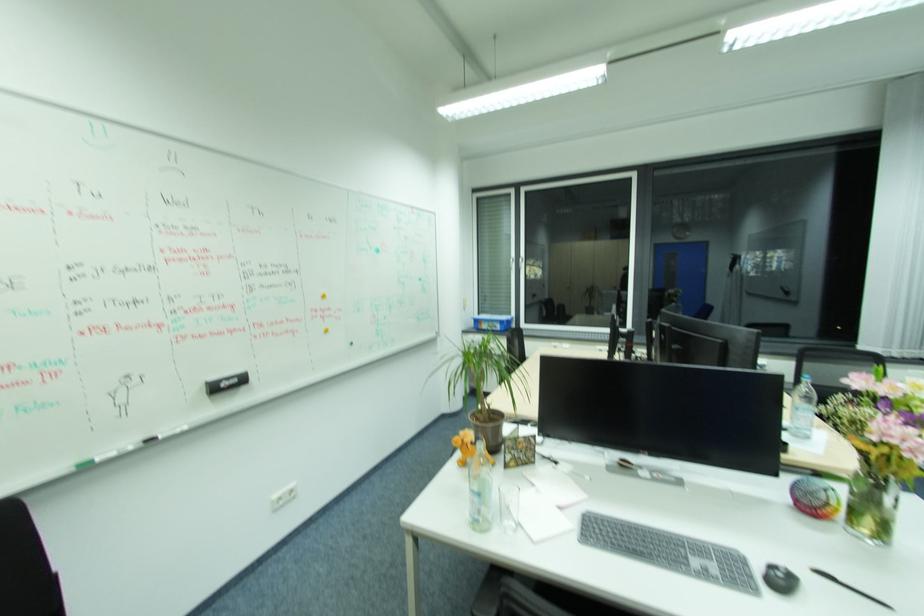
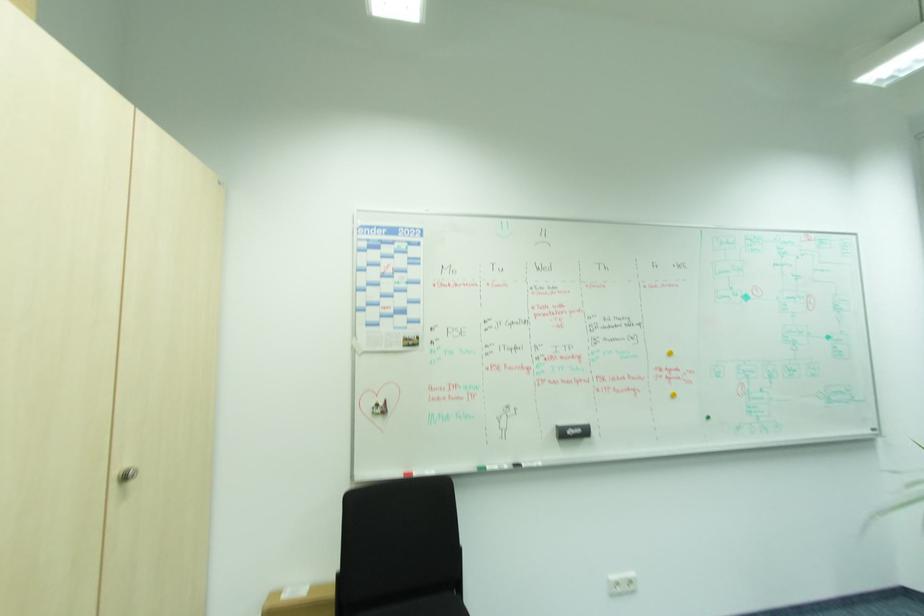
Find the pixel in the second image that matches (x=240, y=381) in the first image.

(584, 430)